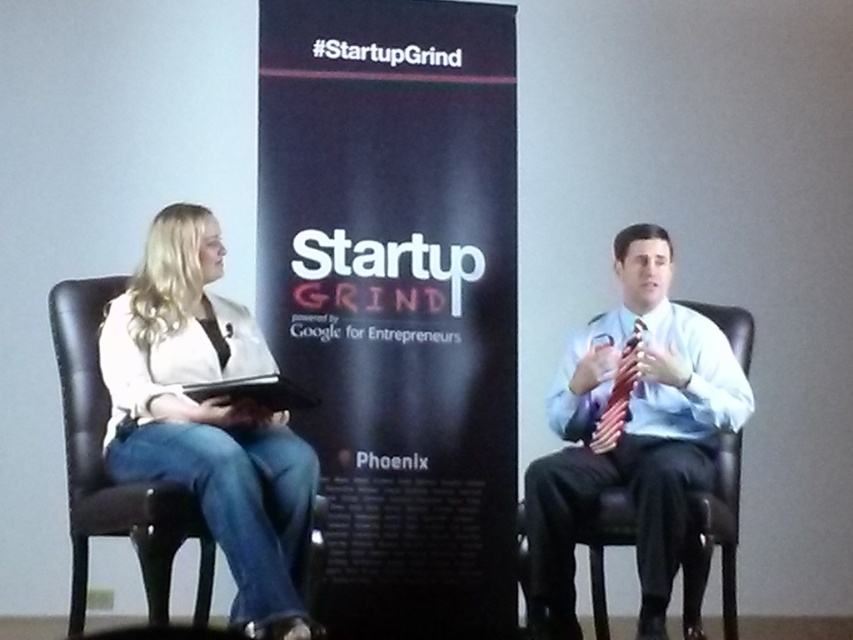
How much distance is there between black paper at center and light blue shirt at center?

black paper at center is 29.74 inches from light blue shirt at center.

Based on the photo, can you confirm if black paper at center is smaller than light blue shirt at center?

Incorrect, black paper at center is not smaller in size than light blue shirt at center.

Is point (445, 372) farther from camera compared to point (646, 273)?

Yes, point (445, 372) is farther from viewer.

At what (x,y) coordinates should I click in order to perform the action: click on black paper at center. Please return your answer as a coordinate pair (x, y). Image resolution: width=853 pixels, height=640 pixels. Looking at the image, I should click on (396, 301).

Is point (660, 474) positioned after point (595, 445)?

No.

Between point (677, 392) and point (635, 324), which one is positioned behind?

Point (635, 324)

Which is behind, point (587, 385) or point (618, 369)?

Point (587, 385)

You are a GUI agent. You are given a task and a screenshot of the screen. Output one action in this format:
    pyautogui.click(x=<x>, y=<y>)
    Task: Click on the light blue shirt at center
    This screenshot has width=853, height=640.
    Given the screenshot: What is the action you would take?
    (x=630, y=435)

Can you confirm if black paper at center is positioned to the right of white matte jacket at left?

Correct, you'll find black paper at center to the right of white matte jacket at left.

Does black paper at center have a smaller size compared to white matte jacket at left?

Incorrect, black paper at center is not smaller in size than white matte jacket at left.

Identify the location of black paper at center. Image resolution: width=853 pixels, height=640 pixels. (396, 301).